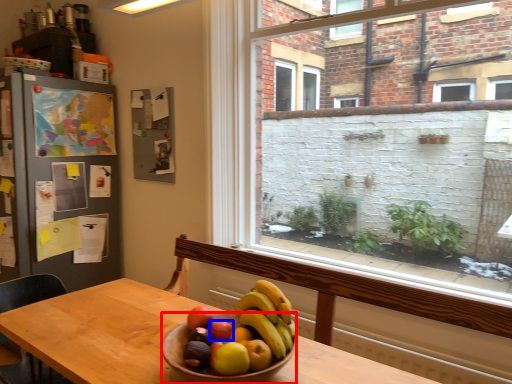
Question: Which point is closer to the camera, bowl (highlighted by a red box) or apple (highlighted by a blue box)?

Choices:
 (A) bowl
 (B) apple

Answer: (A)